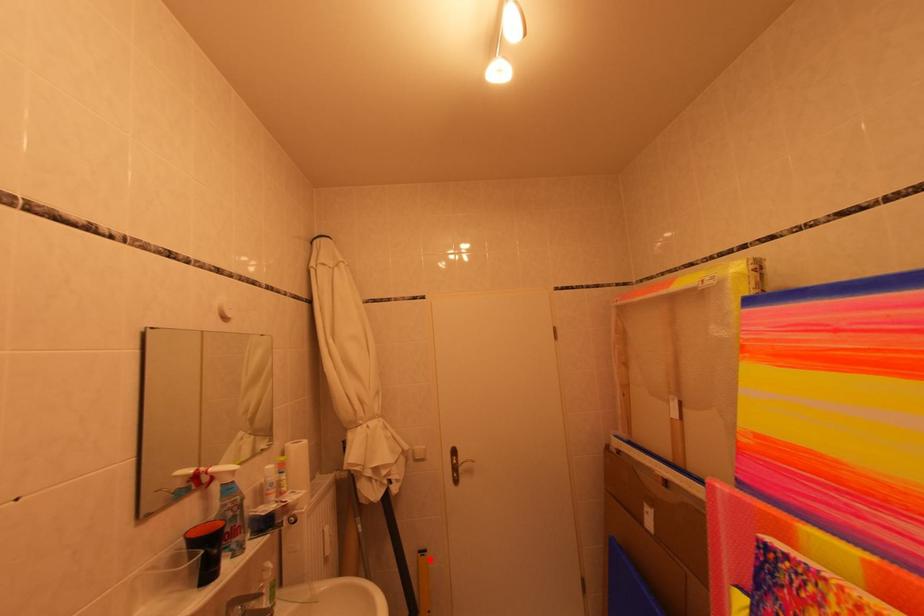
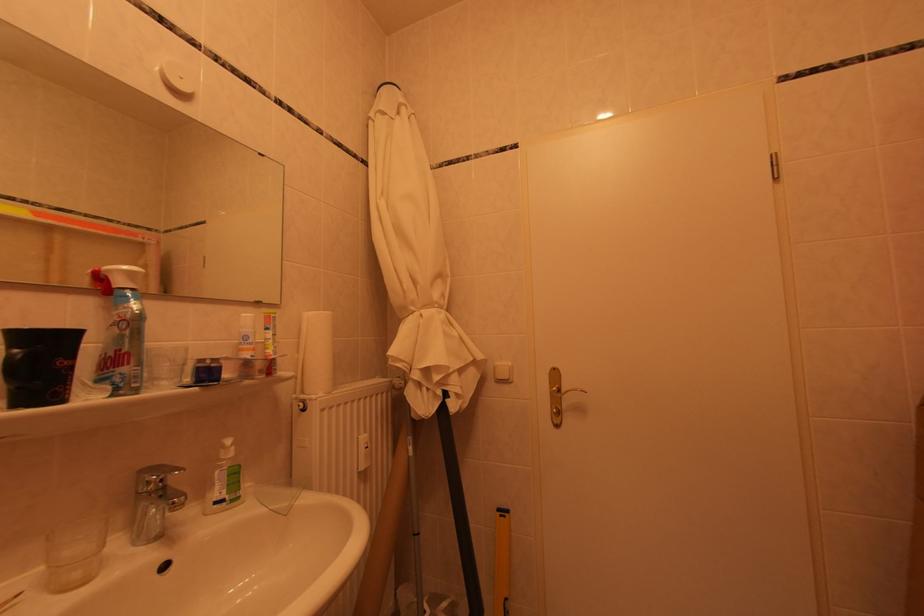
Locate, in the second image, the point that corresponds to the highlighted location in the first image.

(509, 519)